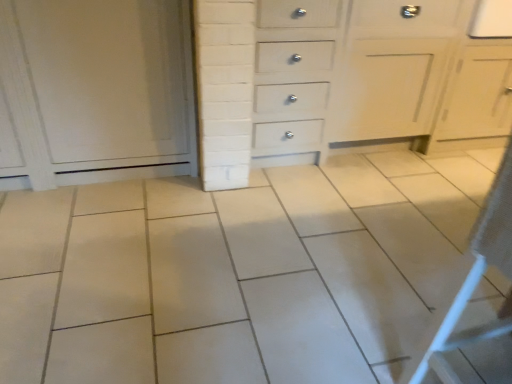
You are a GUI agent. You are given a task and a screenshot of the screen. Output one action in this format:
    pyautogui.click(x=<x>, y=<y>)
    Task: Click on the white plastic ladder at right
    The image size is (512, 384).
    Given the screenshot: What is the action you would take?
    pyautogui.click(x=478, y=277)

The image size is (512, 384). Describe the element at coordinates (478, 277) in the screenshot. I see `white plastic ladder at right` at that location.

This screenshot has width=512, height=384. What are the coordinates of `white plastic ladder at right` in the screenshot? It's located at (478, 277).